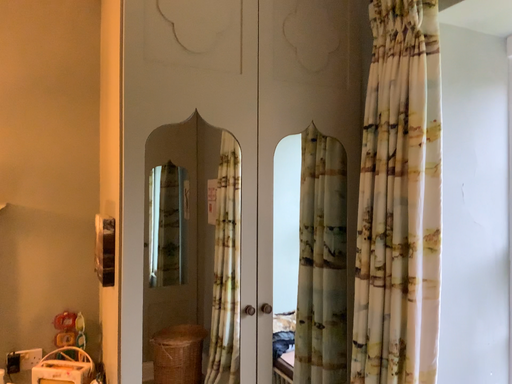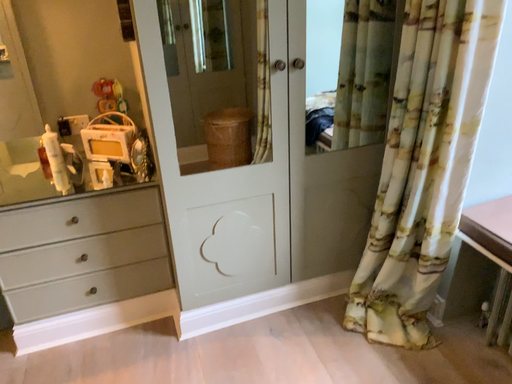
Question: How did the camera likely rotate when shooting the video?

Choices:
 (A) rotated right
 (B) rotated left

Answer: (B)